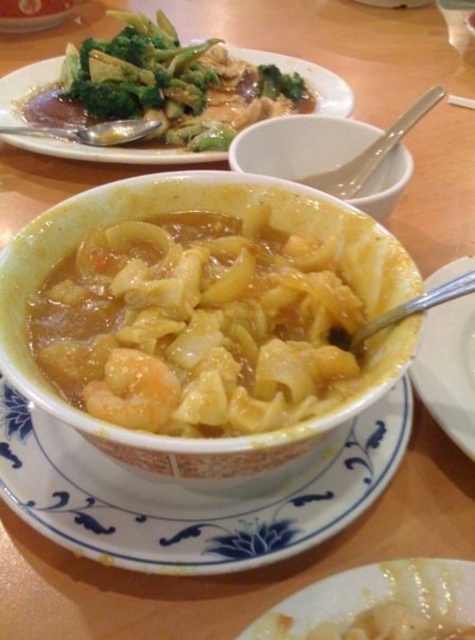
You are sitting at the wooden table and want to reach for the white matte bowl at center and the green leafy vegetables at upper left. Which object is closer to your left side?

The green leafy vegetables at upper left are closer to your left side because the white matte bowl at center is to the right of them.

You are a food critic inspecting the meal setup on the wooden table. You notice two bowls at the center. Which bowl is taller, the white matte bowl at center or the white ceramic bowl at center?

The white ceramic bowl at center is taller than the white matte bowl at center according to the description.